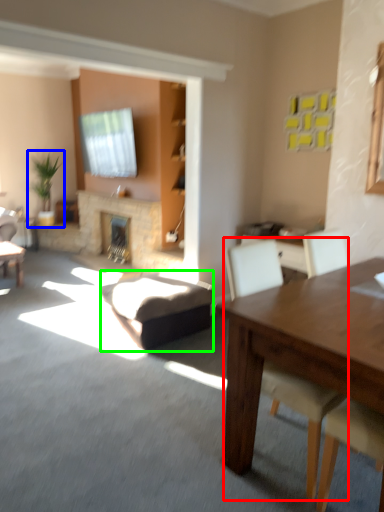
Question: Based on their relative distances, which object is farther from chair (highlighted by a red box)? Choose from houseplant (highlighted by a blue box) and swivel chair (highlighted by a green box).

Choices:
 (A) houseplant
 (B) swivel chair

Answer: (A)